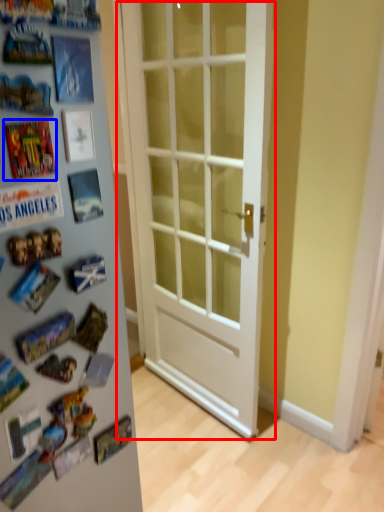
Question: Among these objects, which one is farthest to the camera, door (highlighted by a red box) or comic book (highlighted by a blue box)?

Choices:
 (A) door
 (B) comic book

Answer: (A)